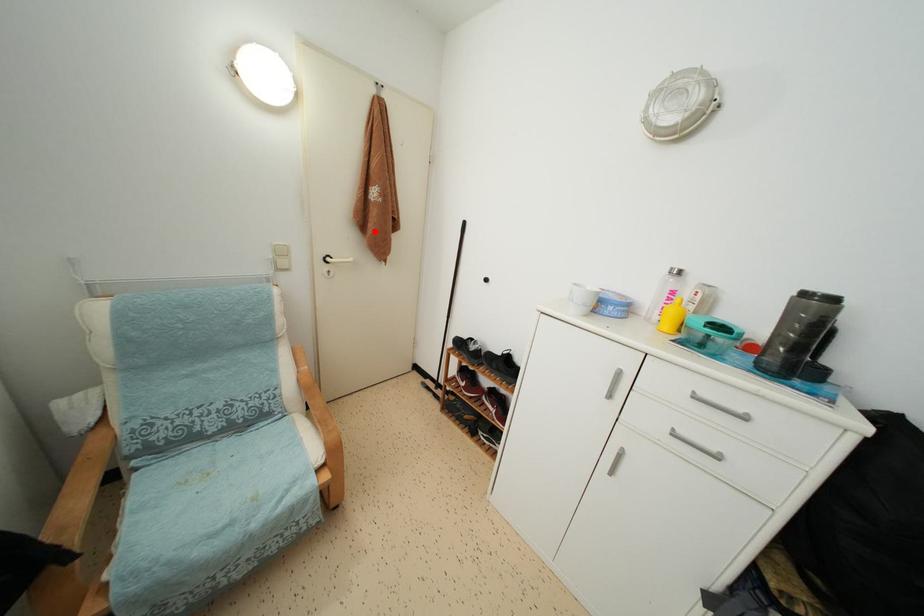
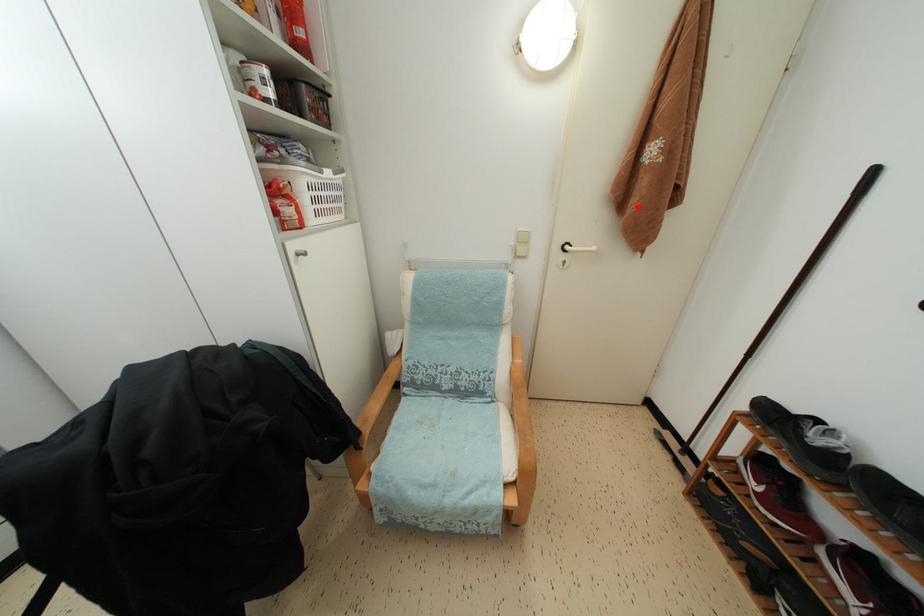
I am providing you with two images of the same scene from different viewpoints. A red point is marked on the first image and another point is marked on the second image. Is the red point in image1 aligned with the point shown in image2?

Yes